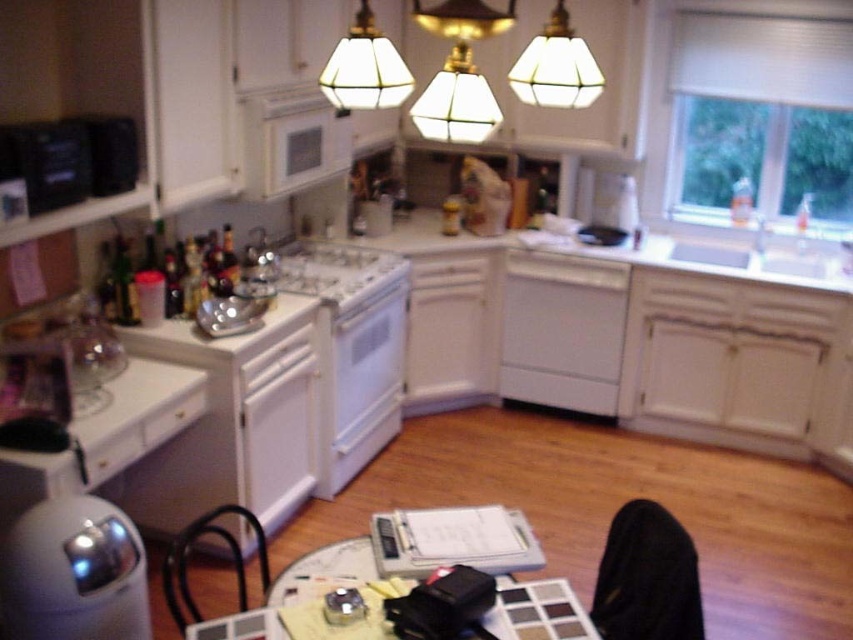
You are standing in the kitchen and want to place a decorative plate between the two points, point (412, 221) and point (381, 92). Since you want the plate to be closer to the stove, which point should you choose?

Point (412, 221) is behind point (381, 92). Since the stove is in the center of the image, placing the plate closer to the stove would require choosing the point that is closer to the center. Point (412, 221) is behind and likely closer to the stove compared to point (381, 92), so you should choose point (412, 221).